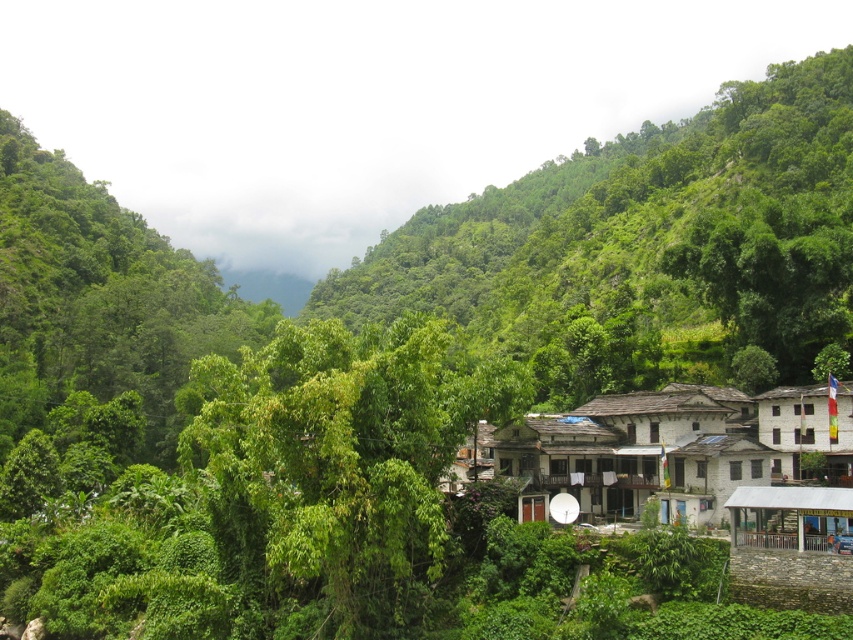
Does white stucco building at center-right have a smaller size compared to white corrugated metal hut at lower right?

No, white stucco building at center-right is not smaller than white corrugated metal hut at lower right.

Does point (582, 440) come behind point (834, 502)?

That is True.

Image resolution: width=853 pixels, height=640 pixels. Find the location of `white stucco building at center-right`. white stucco building at center-right is located at coordinates (669, 449).

Is point (529, 195) positioned before point (779, 534)?

No, (529, 195) is behind (779, 534).

Who is higher up, green leafy tree at center or white corrugated metal hut at lower right?

Positioned higher is green leafy tree at center.

Locate an element on the screen. green leafy tree at center is located at coordinates (645, 248).

Describe the element at coordinates (645, 248) in the screenshot. I see `green leafy tree at center` at that location.

Consider the image. Measure the distance between green leafy tree at center and camera.

green leafy tree at center and camera are 68.80 meters apart from each other.

Locate an element on the screen. Image resolution: width=853 pixels, height=640 pixels. green leafy tree at center is located at coordinates (645, 248).